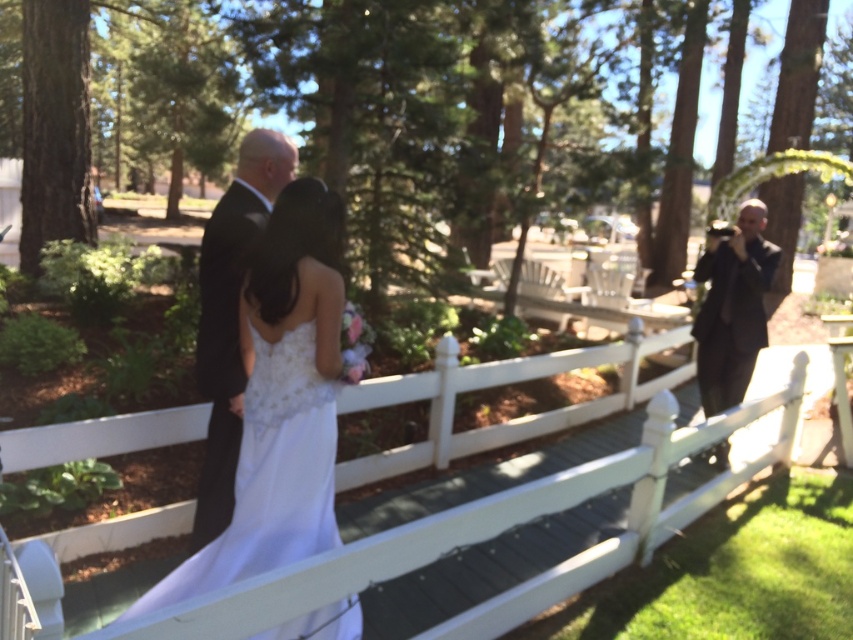
Question: Can you confirm if white wooden fence at center is positioned below black suit at right?

Choices:
 (A) no
 (B) yes

Answer: (B)

Question: Which object appears closest to the camera in this image?

Choices:
 (A) white satin dress at center
 (B) black suit at right
 (C) black satin suit at center
 (D) white wooden fence at center

Answer: (A)

Question: Among these objects, which one is farthest from the camera?

Choices:
 (A) black suit at right
 (B) black satin suit at center
 (C) white wooden fence at center
 (D) white satin dress at center

Answer: (A)

Question: Which of the following is the closest to the observer?

Choices:
 (A) (737, 372)
 (B) (260, 333)

Answer: (B)

Question: Can you confirm if white satin dress at center is bigger than black suit at right?

Choices:
 (A) yes
 (B) no

Answer: (A)

Question: Does white wooden fence at center appear on the left side of white satin dress at center?

Choices:
 (A) no
 (B) yes

Answer: (A)